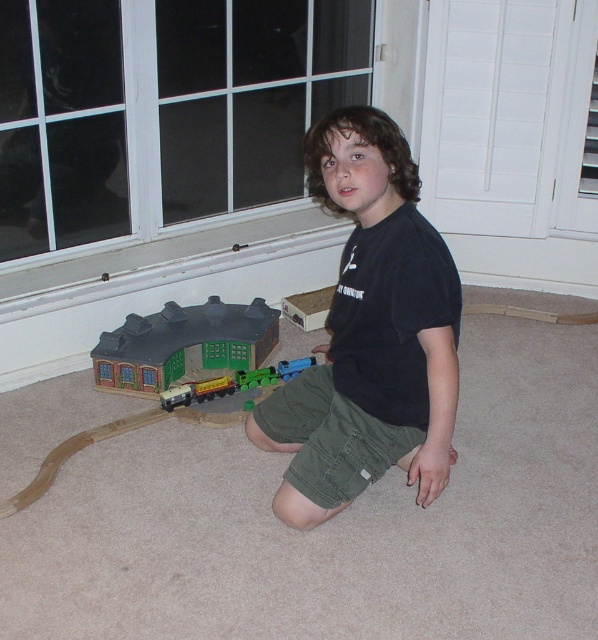
You are a photographer setting up a shot of the scene. You need to focus on the black cotton shirt at center and the white wood screen door at upper right. Which object should you focus on first to ensure both are in sharp focus?

You should focus on the black cotton shirt at center first because it is closer to the viewer than the white wood screen door at upper right. By focusing on the closer object, the depth of field may naturally include the farther object in acceptable focus.

The child is wearing a black cotton shirt at center and there is a white wood screen door at upper right in the room. Which object takes up more space in the image?

The black cotton shirt at center takes up more space in the image because it has a larger size compared to the white wood screen door at upper right.